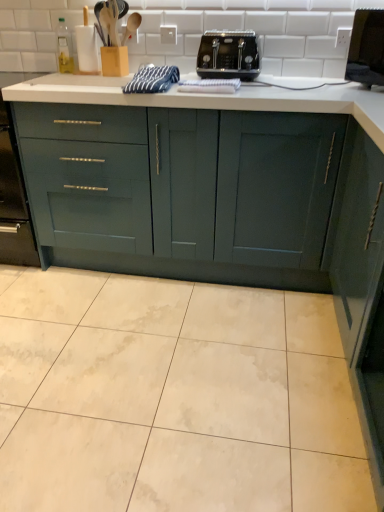
Question: In terms of height, does blue striped towel at center look taller or shorter compared to black plastic toaster at center?

Choices:
 (A) tall
 (B) short

Answer: (B)

Question: Looking at the image, does blue striped towel at center seem bigger or smaller compared to black plastic toaster at center?

Choices:
 (A) big
 (B) small

Answer: (B)

Question: Estimate the real-world distances between objects in this image. Which object is farther from the matte dark green cabinet at right, which is counted as the 2th cabinetry, starting from the left?

Choices:
 (A) black plastic microwave at upper right
 (B) teal matte cabinet at center, acting as the first cabinetry starting from the left
 (C) white plastic electric outlet at upper center
 (D) black plastic toaster at center
 (E) blue striped towel at center

Answer: (C)

Question: Based on their relative distances, which object is nearer to the matte dark green cabinet at right, which is counted as the 2th cabinetry, starting from the left?

Choices:
 (A) black plastic toaster at center
 (B) blue striped towel at center
 (C) teal matte cabinet at center, which appears as the 2th cabinetry when viewed from the right
 (D) black plastic microwave at upper right
 (E) white plastic electric outlet at upper center

Answer: (C)